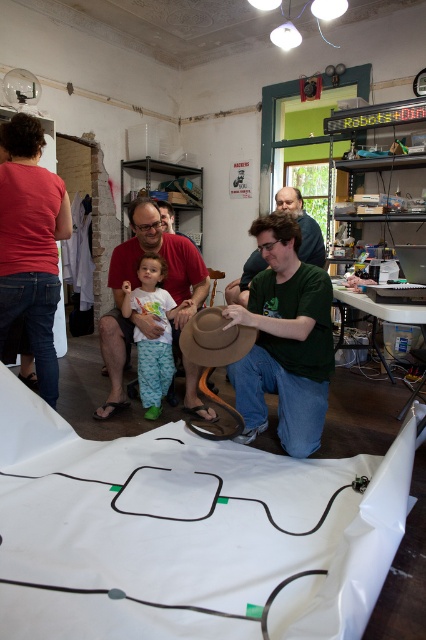
Consider the image. You are a photographer setting up a tripod to take a photo of the brown felt cowboy hat at center and the green matte shirt at center. Which object should you focus on first if you want to ensure both are in focus, considering their heights?

The brown felt cowboy hat at center is shorter than the green matte shirt at center. To ensure both are in focus, focus on the green matte shirt at center first since it is taller, allowing the shorter hat to fall within the depth of field.